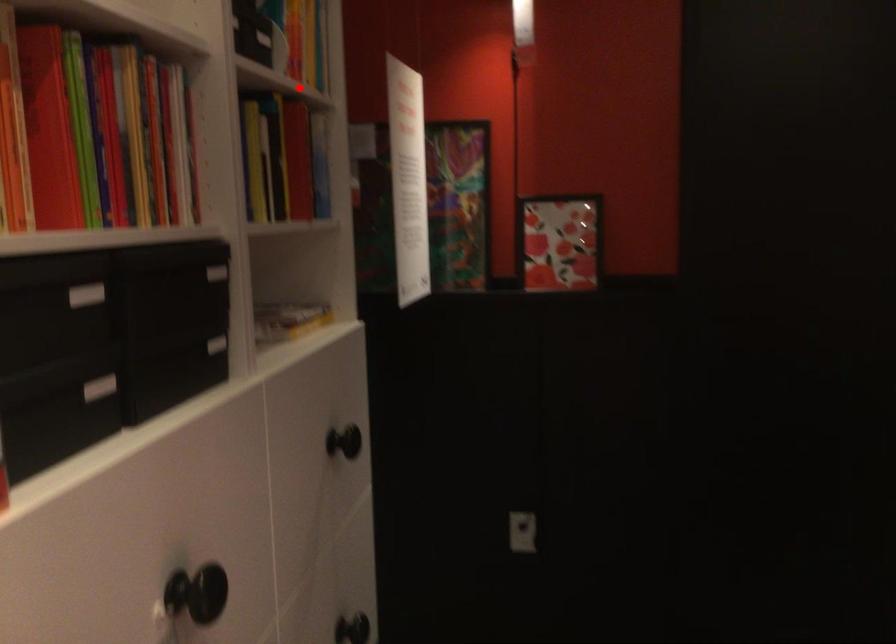
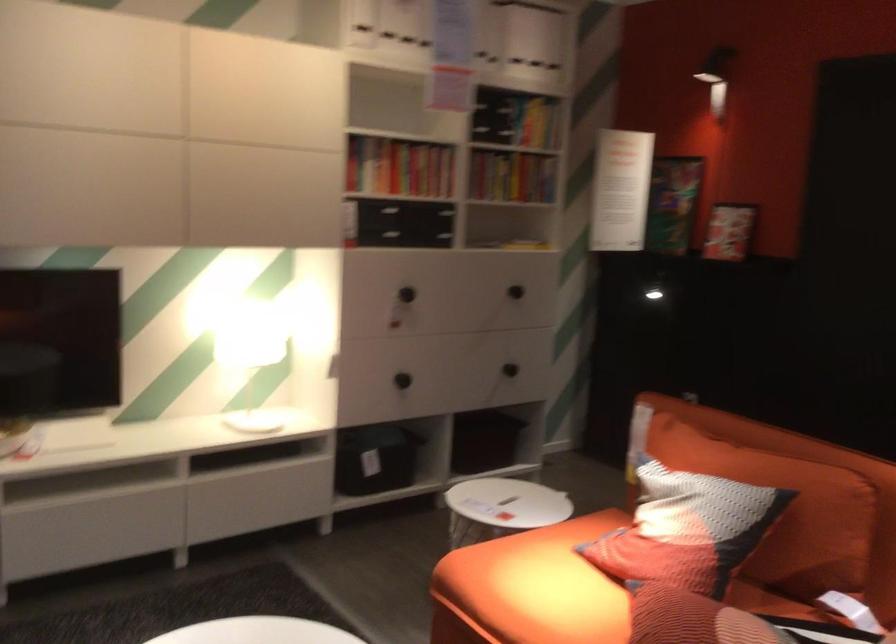
The point at the highlighted location is marked in the first image. Where is the corresponding point in the second image?

(538, 124)